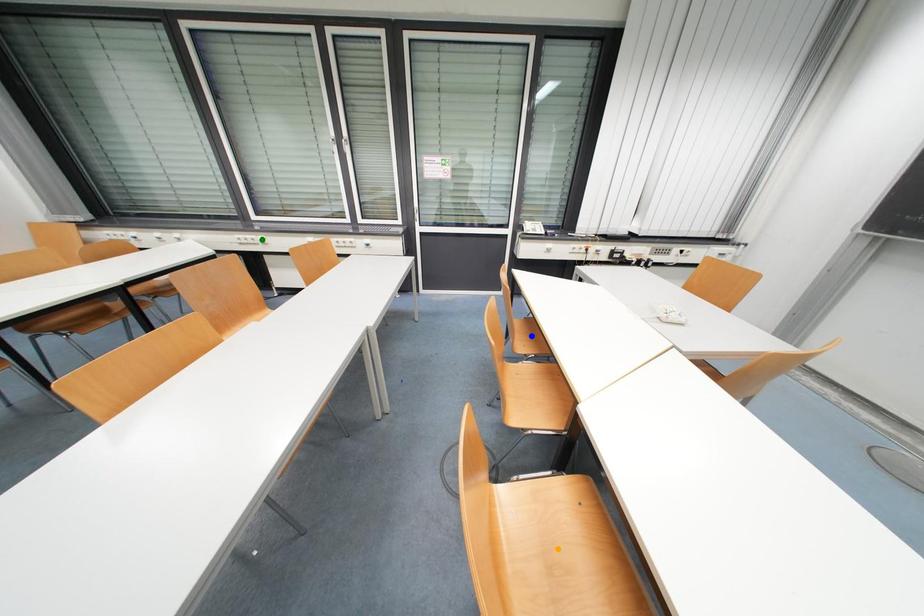
Order these from farthest to nearest:
- green point
- orange point
- blue point

green point, blue point, orange point